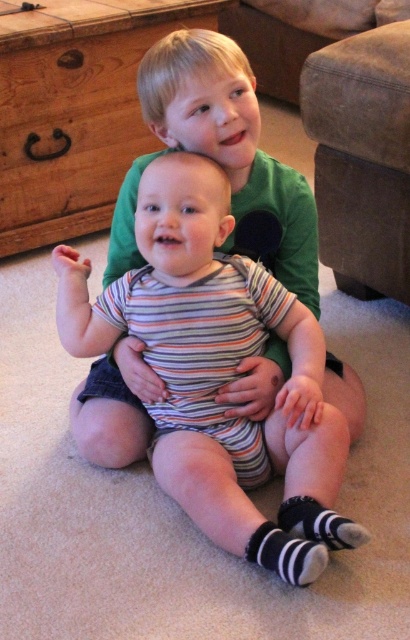
Between suede-like beige armchair at upper right and black striped sock at lower center, which one has less height?

Standing shorter between the two is black striped sock at lower center.

Describe the element at coordinates (362, 157) in the screenshot. Image resolution: width=410 pixels, height=640 pixels. I see `suede-like beige armchair at upper right` at that location.

The width and height of the screenshot is (410, 640). Find the location of `suede-like beige armchair at upper right`. suede-like beige armchair at upper right is located at coordinates (362, 157).

Is striped fabric baby at center thinner than striped fabric sock at lower center?

Incorrect, striped fabric baby at center's width is not less than striped fabric sock at lower center's.

Who is higher up, striped fabric baby at center or striped fabric sock at lower center?

striped fabric baby at center

Identify the location of striped fabric baby at center. The image size is (410, 640). (209, 353).

The height and width of the screenshot is (640, 410). Describe the element at coordinates (287, 554) in the screenshot. I see `black striped sock at lower center` at that location.

Between point (316, 576) and point (352, 538), which one is positioned behind?

Point (352, 538)

Where is `black striped sock at lower center`? This screenshot has width=410, height=640. black striped sock at lower center is located at coordinates (287, 554).